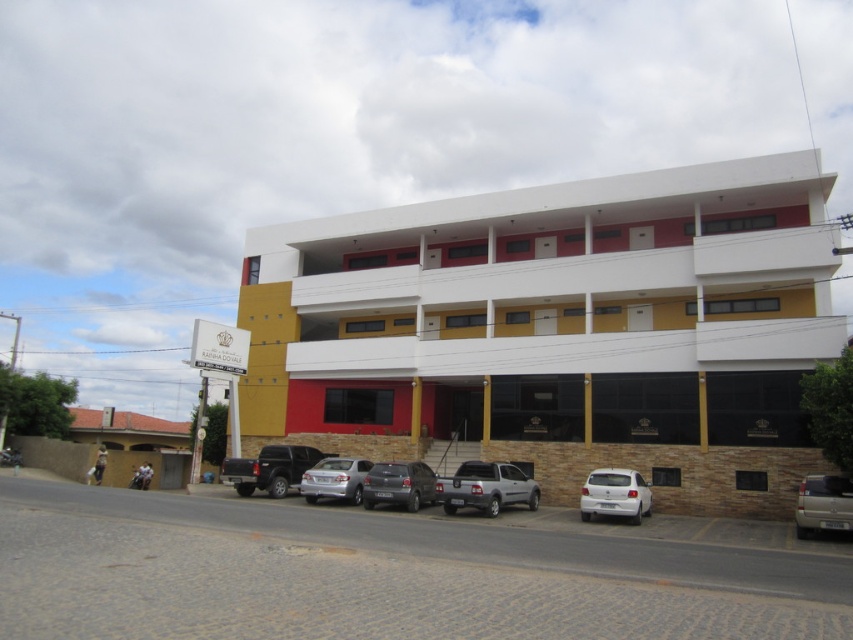
Question: Can you confirm if gold metallic van at lower right is positioned to the left of satin black suv at center?

Choices:
 (A) yes
 (B) no

Answer: (B)

Question: Is the position of brown tiled roof at lower left more distant than that of satin black suv at center?

Choices:
 (A) yes
 (B) no

Answer: (A)

Question: Based on their relative distances, which object is nearer to the satin silver car at center?

Choices:
 (A) yellow brick building at center
 (B) satin black suv at center
 (C) gold metallic van at lower right
 (D) satin silver pickup truck at center

Answer: (B)

Question: Is yellow brick building at center to the right of satin black suv at center from the viewer's perspective?

Choices:
 (A) no
 (B) yes

Answer: (B)

Question: Which object is farther from the camera taking this photo?

Choices:
 (A) brown tiled roof at lower left
 (B) gold metallic van at lower right
 (C) white matte hatchback at lower right

Answer: (A)

Question: Among these points, which one is farthest from the camera?

Choices:
 (A) (437, 486)
 (B) (126, 440)
 (C) (798, 490)
 (D) (630, 500)

Answer: (B)